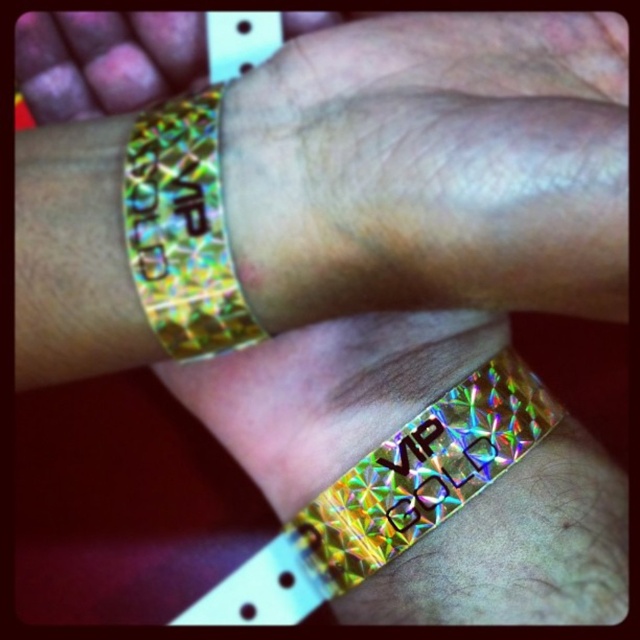
Is holographic vip wristband at center smaller than holographic gold wristband at upper center?

Incorrect, holographic vip wristband at center is not smaller in size than holographic gold wristband at upper center.

Does holographic vip wristband at center have a lesser height compared to holographic gold wristband at upper center?

Incorrect, holographic vip wristband at center's height does not fall short of holographic gold wristband at upper center's.

Between point (236, 572) and point (132, 182), which one is positioned behind?

Point (236, 572)

The image size is (640, 640). Find the location of `holographic vip wristband at center`. holographic vip wristband at center is located at coordinates (392, 496).